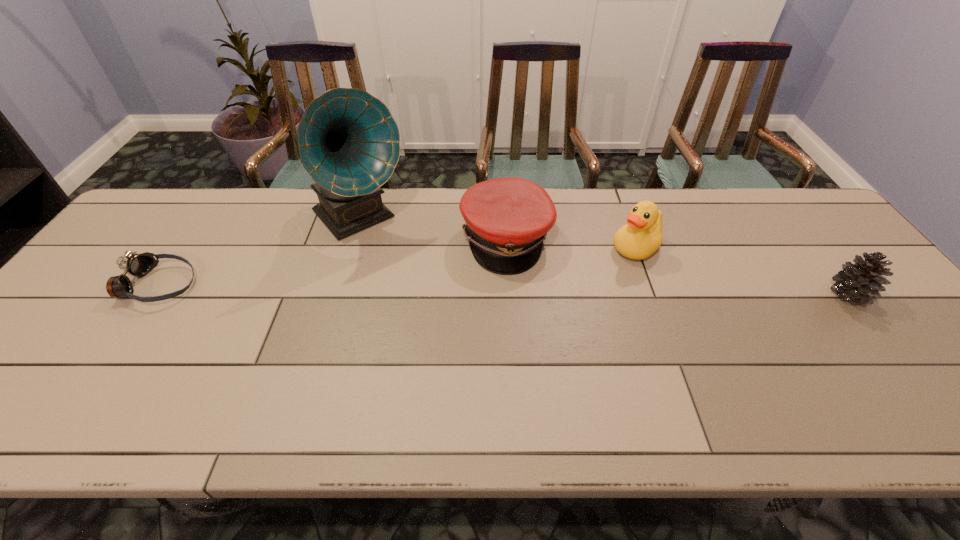
You are a GUI agent. You are given a task and a screenshot of the screen. Output one action in this format:
    pyautogui.click(x=<x>, y=<y>)
    Task: Click on the vacant space on the desktop that is between the shortest object and the pinecone and is positioned at the beak of the duck
    
    Given the screenshot: What is the action you would take?
    pyautogui.click(x=579, y=291)

Identify the location of vacant space on the desktop that is between the shortest object and the pinecone and is positioned from the horn of the second object from left to right. (424, 289).

The height and width of the screenshot is (540, 960). In order to click on vacant space on the desktop that is between the goggles and the pinecone and is positioned at the front of the cap where the visor is located in this screenshot , I will do `click(595, 291)`.